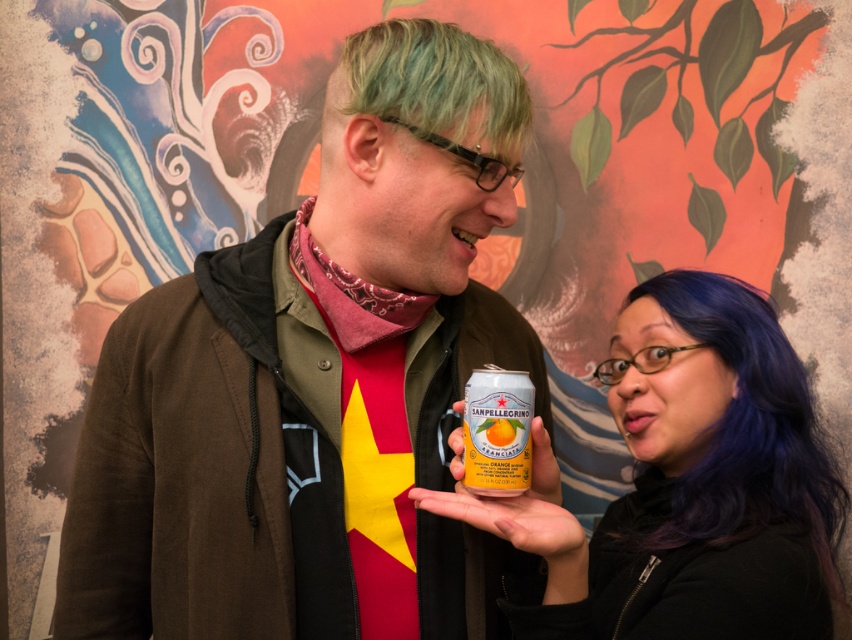
Question: Which point is closer to the camera?

Choices:
 (A) (450, 26)
 (B) (562, 538)
 (C) (557, 547)
 (D) (289, 509)

Answer: (B)

Question: Can you confirm if metallic can at center is smaller than green dyed hair at upper center?

Choices:
 (A) yes
 (B) no

Answer: (B)

Question: Observing the image, what is the correct spatial positioning of metallic can at center in reference to yellow matte can at center?

Choices:
 (A) left
 (B) right

Answer: (A)

Question: Which of the following is the farthest from the observer?

Choices:
 (A) yellow matte can at center
 (B) green dyed hair at upper center
 (C) metallic can at center
 (D) metallic silver can at center

Answer: (B)

Question: Can you confirm if metallic can at center is positioned to the left of yellow matte can at center?

Choices:
 (A) yes
 (B) no

Answer: (A)

Question: Which of these objects is positioned closest to the yellow matte can at center?

Choices:
 (A) metallic silver can at center
 (B) shiny metallic can at center

Answer: (A)